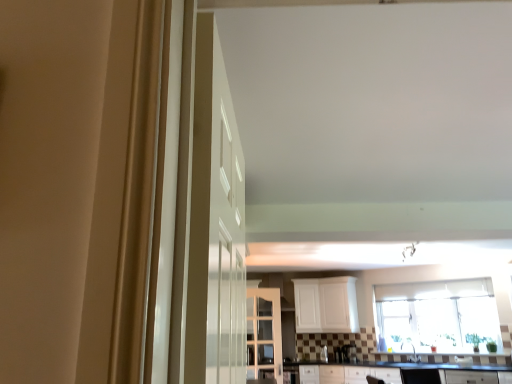
Question: Is white glossy sink at center aimed at clear glass window at center?

Choices:
 (A) no
 (B) yes

Answer: (A)

Question: From a real-world perspective, is white glossy sink at center positioned over clear glass window at center based on gravity?

Choices:
 (A) no
 (B) yes

Answer: (A)

Question: Is white glossy sink at center at the right side of clear glass window at center?

Choices:
 (A) no
 (B) yes

Answer: (A)

Question: Considering the relative sizes of white glossy sink at center and clear glass window at center in the image provided, is white glossy sink at center bigger than clear glass window at center?

Choices:
 (A) yes
 (B) no

Answer: (B)

Question: From the image's perspective, would you say white glossy sink at center is positioned over clear glass window at center?

Choices:
 (A) no
 (B) yes

Answer: (A)

Question: In terms of width, does black laminate countertop at lower center look wider or thinner when compared to white glossy cabinet at center, positioned as the first cabinetry in left-to-right order?

Choices:
 (A) wide
 (B) thin

Answer: (A)

Question: Is black laminate countertop at lower center inside or outside of white glossy cabinet at center, acting as the 1th cabinetry starting from the front?

Choices:
 (A) outside
 (B) inside

Answer: (A)

Question: Does point (287, 364) appear closer or farther from the camera than point (269, 301)?

Choices:
 (A) closer
 (B) farther

Answer: (A)

Question: In the image, is black laminate countertop at lower center positioned in front of or behind white glossy cabinet at center, which is counted as the 2th cabinetry, starting from the right?

Choices:
 (A) behind
 (B) front

Answer: (B)

Question: In the image, is clear glass window at center positioned in front of or behind white glossy sink at center?

Choices:
 (A) behind
 (B) front

Answer: (B)

Question: From their relative heights in the image, would you say clear glass window at center is taller or shorter than white glossy sink at center?

Choices:
 (A) short
 (B) tall

Answer: (B)

Question: Considering the positions of clear glass window at center and white glossy sink at center in the image, is clear glass window at center bigger or smaller than white glossy sink at center?

Choices:
 (A) small
 (B) big

Answer: (B)

Question: From a real-world perspective, is clear glass window at center above or below white glossy sink at center?

Choices:
 (A) above
 (B) below

Answer: (A)

Question: In the image, is white matte cabinet at center, the second cabinetry viewed from the front, positioned in front of or behind clear glass window at center?

Choices:
 (A) front
 (B) behind

Answer: (B)

Question: Considering the positions of point (308, 324) and point (413, 329), is point (308, 324) closer or farther from the camera than point (413, 329)?

Choices:
 (A) farther
 (B) closer

Answer: (B)